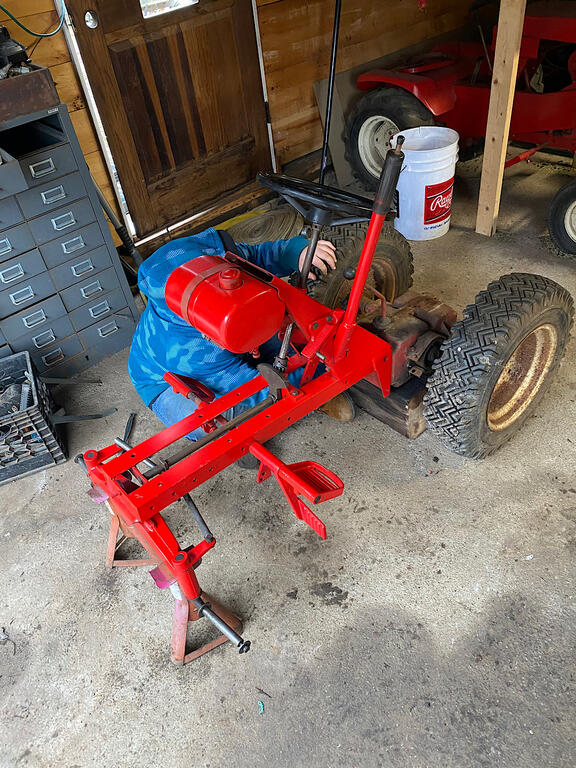
Where is `filing cabinet`? This screenshot has height=768, width=576. filing cabinet is located at coordinates (86, 263).